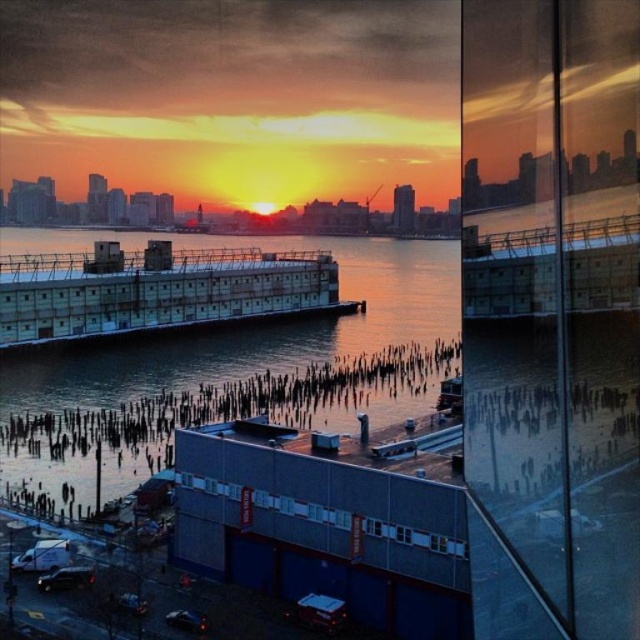
Question: Which object appears farthest from the camera in this image?

Choices:
 (A) blue matte building at center
 (B) reflective glass water at center

Answer: (B)

Question: Can you confirm if reflective glass water at center is positioned above blue matte building at center?

Choices:
 (A) no
 (B) yes

Answer: (B)

Question: Does reflective glass water at center appear over blue matte building at center?

Choices:
 (A) yes
 (B) no

Answer: (A)

Question: Which point is farther to the camera?

Choices:
 (A) reflective glass water at center
 (B) blue matte building at center

Answer: (A)

Question: Is reflective glass water at center closer to camera compared to blue matte building at center?

Choices:
 (A) yes
 (B) no

Answer: (B)

Question: Which point is closer to the camera?

Choices:
 (A) reflective glass water at center
 (B) blue matte building at center

Answer: (B)